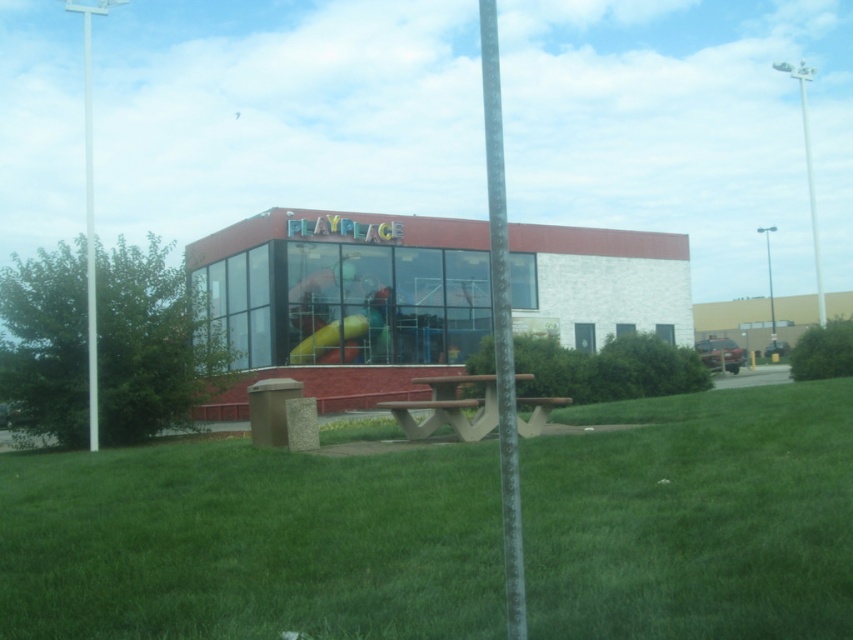
Question: Does brown wood picnic table at center appear under brown wood park bench at center?

Choices:
 (A) yes
 (B) no

Answer: (A)

Question: Does brown wood park bench at center have a lesser width compared to yellow rubber slide at center?

Choices:
 (A) no
 (B) yes

Answer: (B)

Question: Considering the real-world distances, which object is closest to the yellow rubber slide at center?

Choices:
 (A) brown wood picnic table at center
 (B) white metallic pole at upper right

Answer: (A)

Question: Is brown wood park bench at center wider than yellow rubber slide at center?

Choices:
 (A) yes
 (B) no

Answer: (B)

Question: Which point is closer to the camera?

Choices:
 (A) brown concrete picnic table at center
 (B) brown wood park bench at center
 (C) brown wood picnic table at center
 (D) yellow rubber slide at center

Answer: (A)

Question: Which object is positioned closest to the metallic pole at left?

Choices:
 (A) brown concrete picnic table at center
 (B) brown wood park bench at center
 (C) brown wood picnic table at center
 (D) metallic pole at center

Answer: (A)